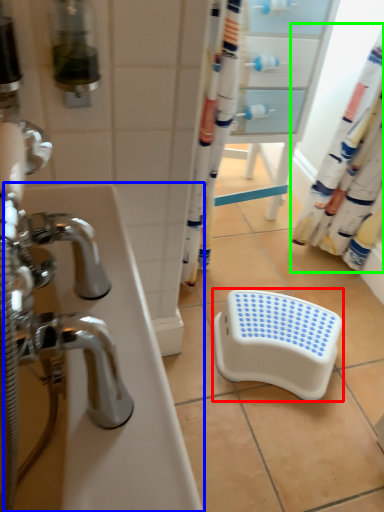
Question: Which object is the closest to the step stool (highlighted by a red box)? Choose among these: bath (highlighted by a blue box) or shower curtain (highlighted by a green box).

Choices:
 (A) bath
 (B) shower curtain

Answer: (B)